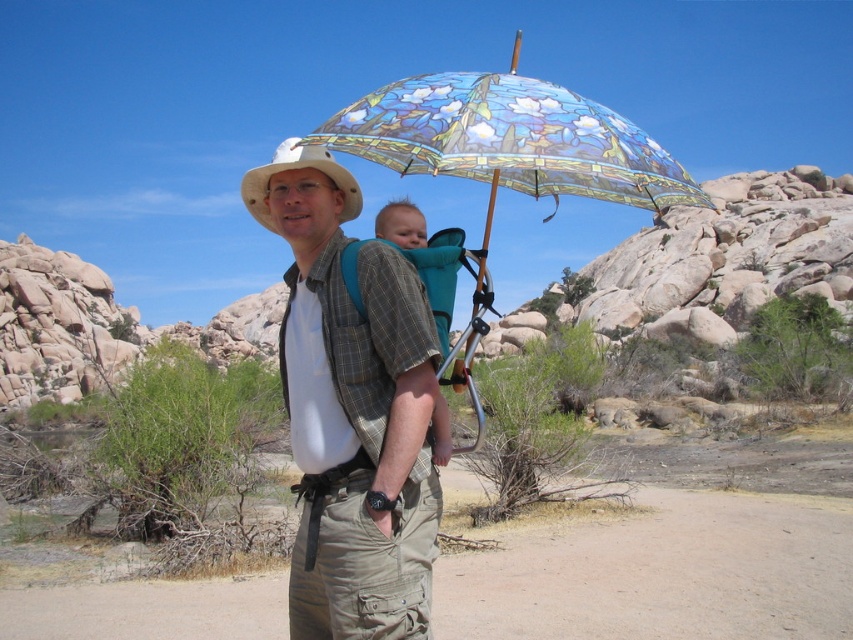
Question: Which object is farther from the camera taking this photo?

Choices:
 (A) white matte cowboy hat at center
 (B) stained glass umbrella at upper center
 (C) teal fabric carrier at center
 (D) plaid shirt at center

Answer: (A)

Question: Considering the real-world distances, which object is farthest from the stained glass umbrella at upper center?

Choices:
 (A) white matte cowboy hat at center
 (B) teal fabric carrier at center

Answer: (B)

Question: Can you confirm if stained glass umbrella at upper center is positioned to the right of teal fabric carrier at center?

Choices:
 (A) no
 (B) yes

Answer: (B)

Question: Does plaid shirt at center appear on the right side of white matte cowboy hat at center?

Choices:
 (A) no
 (B) yes

Answer: (B)

Question: Which of the following is the closest to the observer?

Choices:
 (A) stained glass umbrella at upper center
 (B) teal fabric carrier at center
 (C) plaid shirt at center
 (D) white matte cowboy hat at center

Answer: (C)

Question: Can you confirm if plaid shirt at center is positioned to the left of stained glass umbrella at upper center?

Choices:
 (A) yes
 (B) no

Answer: (A)